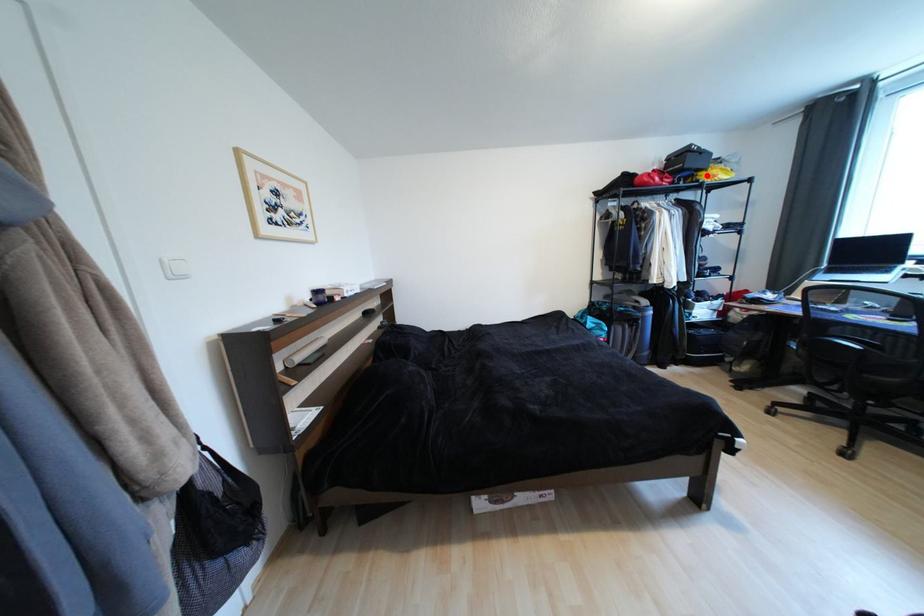
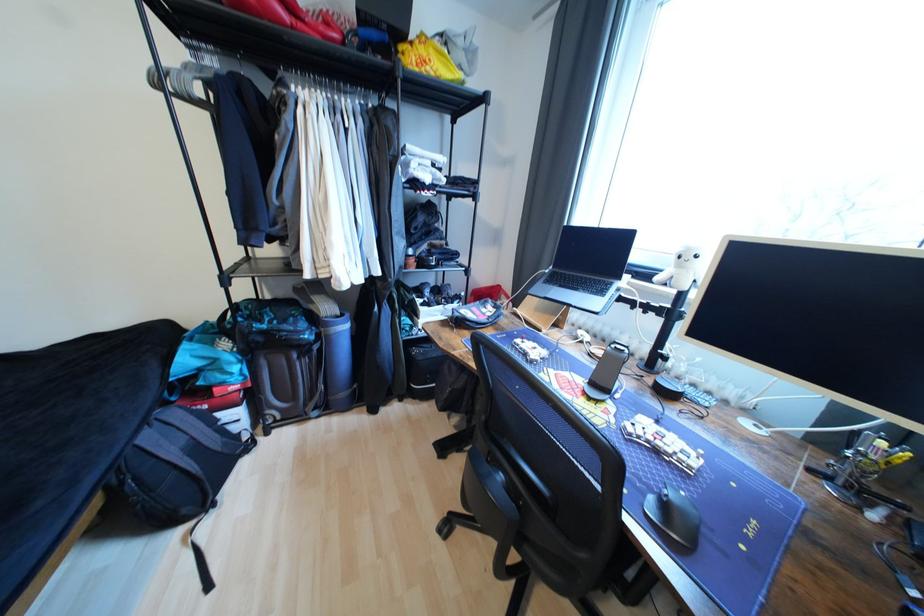
Question: I am providing you with two images of the same scene from different viewpoints. A red point is marked on the first image. At the location where the point appears in image 1, is it still visible in image 2?

Choices:
 (A) Yes
 (B) No

Answer: (A)